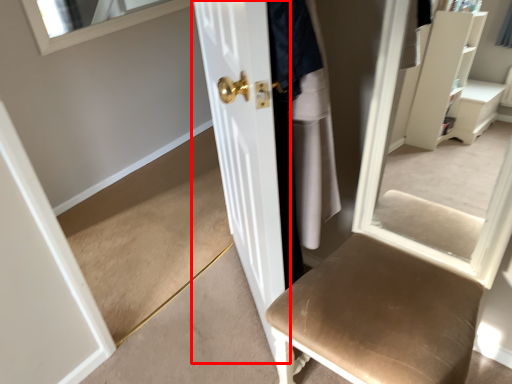
Question: From the image's perspective, considering the relative positions of door (annotated by the red box) and clothing in the image provided, where is door (annotated by the red box) located with respect to the staircase?

Choices:
 (A) below
 (B) above

Answer: (A)